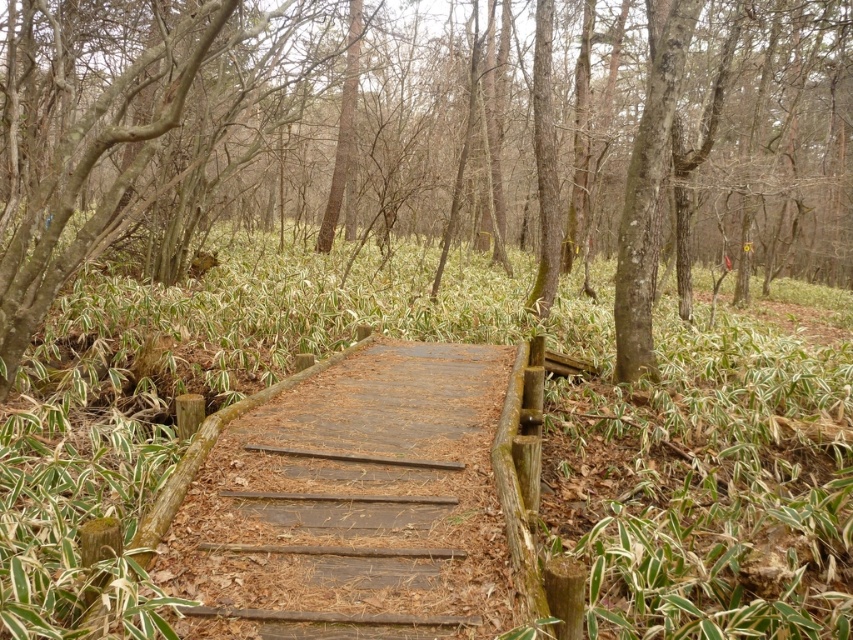
Question: Which of the following is the closest to the observer?

Choices:
 (A) (57, 320)
 (B) (488, 36)

Answer: (A)

Question: Which point is closer to the camera?

Choices:
 (A) weathered wood path at center
 (B) green leafy plants at center
 (C) brown wood bridge at center

Answer: (B)

Question: Is green leafy plants at center to the left of weathered wood path at center from the viewer's perspective?

Choices:
 (A) yes
 (B) no

Answer: (B)

Question: Which of the following is the closest to the observer?

Choices:
 (A) (157, 257)
 (B) (277, 614)
 (C) (204, 397)

Answer: (B)

Question: Is green leafy plants at center thinner than weathered wood path at center?

Choices:
 (A) yes
 (B) no

Answer: (B)

Question: Is green leafy plants at center bigger than weathered wood path at center?

Choices:
 (A) no
 (B) yes

Answer: (B)